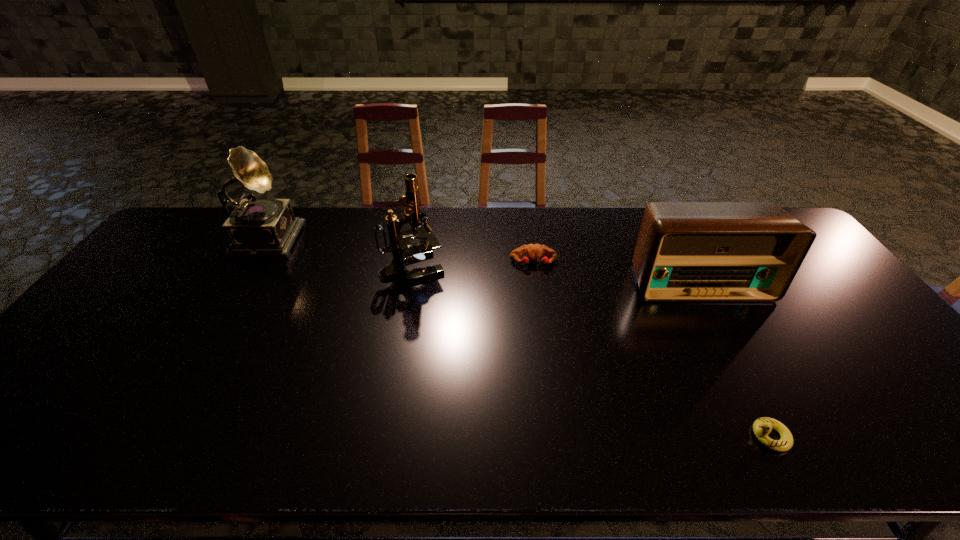
This screenshot has width=960, height=540. I want to click on free space that satisfies the following two spatial constraints: 1. on the front-facing side of the radio receiver; 2. on the face of the nearest object, so click(x=783, y=436).